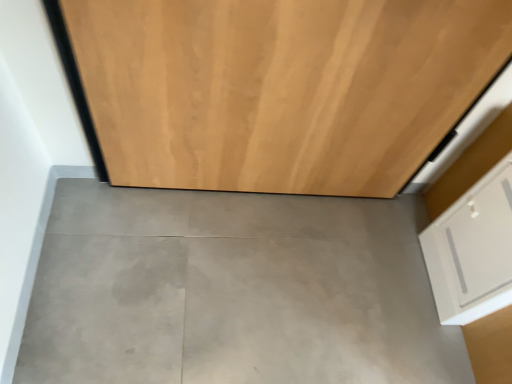
Where is `blank space above gray concrete floor at center (from a real-world perspective)`? The image size is (512, 384). blank space above gray concrete floor at center (from a real-world perspective) is located at coordinates (253, 269).